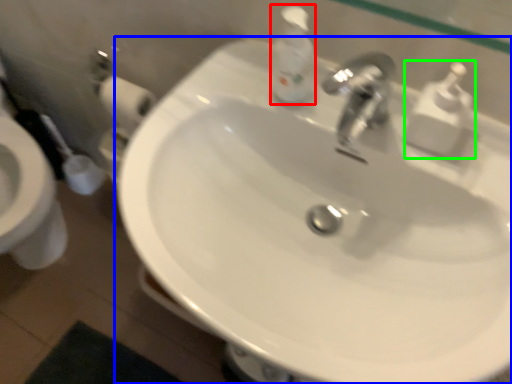
Question: Considering the real-world distances, which object is closest to soap dispenser (highlighted by a red box)? sink (highlighted by a blue box) or soap dispenser (highlighted by a green box).

Choices:
 (A) sink
 (B) soap dispenser

Answer: (B)